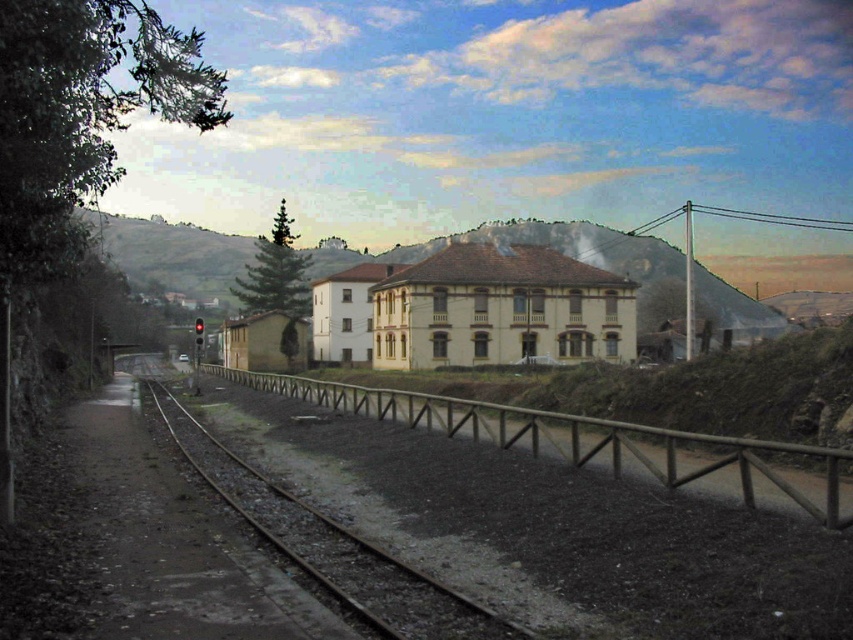
You are a railway inspector checking the alignment of the brown wooden rail at center and the brown wooden track at center. Which one is wider?

The brown wooden rail at center is wider than the brown wooden track at center.

You are a construction worker needing to place a 7.5 meter long beam between the brown wooden rail at center and the brown wooden track at center. Can you fit the beam horizontally between them without bending it?

The distance between the brown wooden rail at center and the brown wooden track at center is 6.74 meters, which is shorter than the beam length of 7.5 meters. Therefore, the beam cannot be placed horizontally between them without bending it.

You are a maintenance worker inspecting the railway track and wooden fence. You need to compare the heights of the brown wooden rail at center and the brown wooden track at center. Which one is taller?

The brown wooden rail at center is taller than the brown wooden track at center.